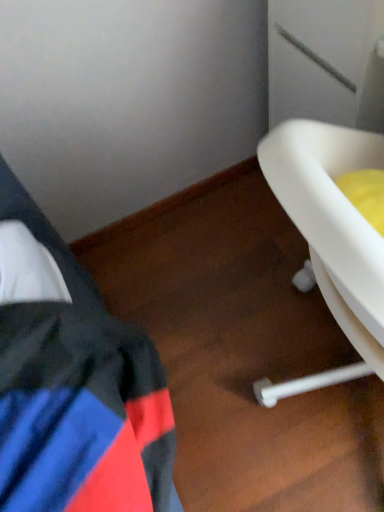
This screenshot has height=512, width=384. Describe the element at coordinates (330, 237) in the screenshot. I see `white plastic chair at right` at that location.

This screenshot has height=512, width=384. Find the location of `white plastic chair at right`. white plastic chair at right is located at coordinates (330, 237).

At what (x,y) coordinates should I click in order to perform the action: click on white plastic chair at right. Please return your answer as a coordinate pair (x, y). The height and width of the screenshot is (512, 384). Looking at the image, I should click on (330, 237).